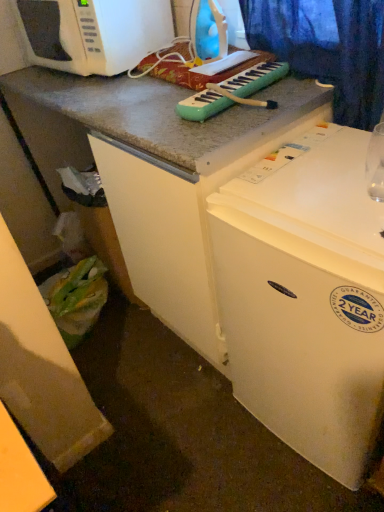
The image size is (384, 512). Find the location of `free space to the back side of transparent glass at upper right`. free space to the back side of transparent glass at upper right is located at coordinates click(346, 162).